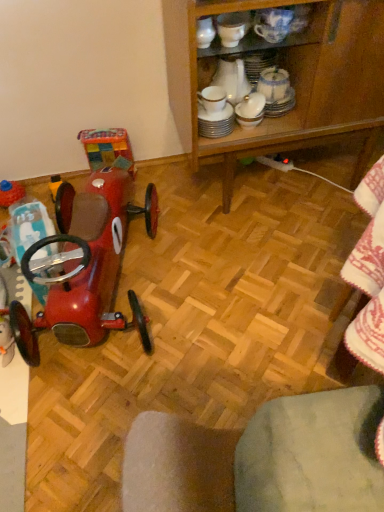
Locate an element on the screen. The height and width of the screenshot is (512, 384). free region under wooden cabinet at center (from a real-world perspective) is located at coordinates (294, 181).